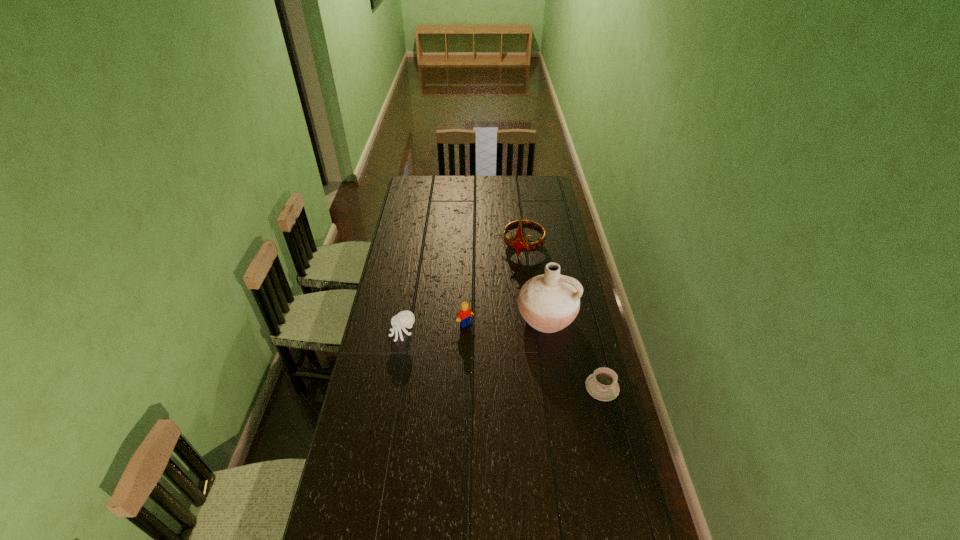
Find the location of a particular element. free space on the desktop that is between the leftmost object and the shortest object and is positioned on the face of the Lego is located at coordinates (495, 359).

You are a GUI agent. You are given a task and a screenshot of the screen. Output one action in this format:
    pyautogui.click(x=<x>, y=<y>)
    Task: Click on the free space on the desktop that is between the octopus and the shortest object and is positioned on the front-facing side of the farthest object
    This screenshot has height=540, width=960.
    Given the screenshot: What is the action you would take?
    pyautogui.click(x=474, y=353)

At what (x,y) coordinates should I click in order to perform the action: click on free space on the desktop that is between the leftmost object and the teacup and is positioned to pour from the handle of the pottery. Please return your answer as a coordinate pair (x, y). The width and height of the screenshot is (960, 540). Looking at the image, I should click on (520, 365).